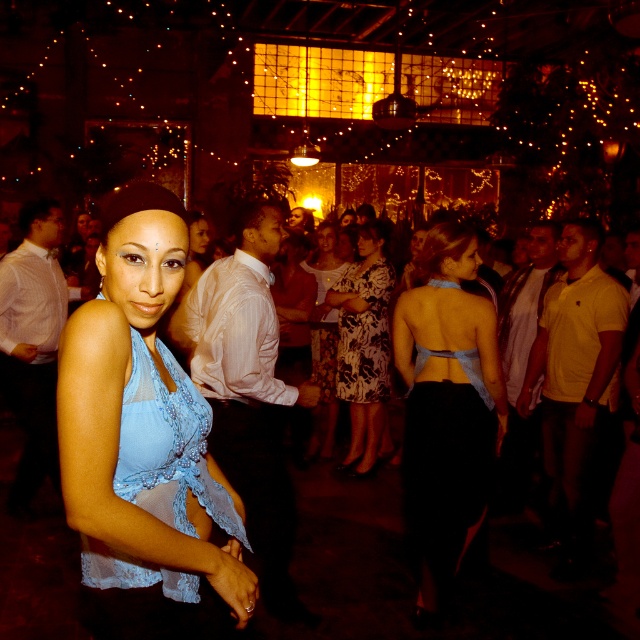
Can you confirm if white sheer shirt at center is shorter than yellow cotton shirt at right?

No.

Can you confirm if white sheer shirt at center is positioned to the right of yellow cotton shirt at right?

No, white sheer shirt at center is not to the right of yellow cotton shirt at right.

Does point (278, 529) come closer to viewer compared to point (518, 328)?

Yes, it is in front of point (518, 328).

Find the location of a particular element. The image size is (640, 640). white sheer shirt at center is located at coordinates (248, 392).

Does floral-patterned dress at center appear under yellow cotton shirt at right?

No.

Between floral-patterned dress at center and yellow cotton shirt at right, which one has less height?

yellow cotton shirt at right is shorter.

Between point (349, 410) and point (508, 368), which one is positioned in front?

Point (508, 368) is in front.

You are a GUI agent. You are given a task and a screenshot of the screen. Output one action in this format:
    pyautogui.click(x=<x>, y=<y>)
    Task: Click on the floral-patterned dress at center
    
    Given the screenshot: What is the action you would take?
    pyautogui.click(x=364, y=342)

The height and width of the screenshot is (640, 640). What do you see at coordinates (576, 378) in the screenshot?
I see `yellow cotton polo shirt at right` at bounding box center [576, 378].

How far apart are yellow cotton polo shirt at right and matte white blouse at center?

yellow cotton polo shirt at right is 2.46 meters away from matte white blouse at center.

Is point (580, 404) positioned after point (208, 232)?

No, (580, 404) is in front of (208, 232).

This screenshot has height=640, width=640. I want to click on yellow cotton polo shirt at right, so click(576, 378).